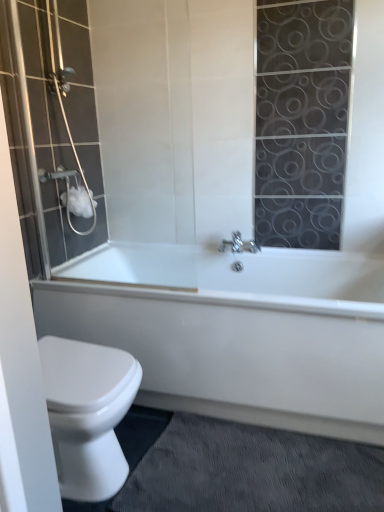
Describe the element at coordinates (79, 202) in the screenshot. The width and height of the screenshot is (384, 512). I see `white matte toilet paper at upper left` at that location.

Locate an element on the screen. This screenshot has height=512, width=384. matte glass shower door at left is located at coordinates (51, 123).

From the image's perspective, which one is positioned lower, white glossy bathtub at lower center or gray textured bath mat at lower right?

gray textured bath mat at lower right appears lower in the image.

The height and width of the screenshot is (512, 384). Identify the location of bathtub above the gray textured bath mat at lower right (from a real-world perspective). (240, 333).

From the picture: Which point is more distant from viewer, [143,383] or [153,477]?

The point [143,383] is more distant.

Is white glossy bathtub at lower center shorter than gray textured bath mat at lower right?

In fact, white glossy bathtub at lower center may be taller than gray textured bath mat at lower right.

Based on the photo, choose the correct answer: Is white matte toilet paper at upper left inside matte glass shower door at left or outside it?

white matte toilet paper at upper left is located inside matte glass shower door at left.

This screenshot has width=384, height=512. What are the coordinates of `toilet paper on the left of matte glass shower door at left` in the screenshot? It's located at (79, 202).

From a real-world perspective, which object stands above the other?

From a 3D spatial view, matte glass shower door at left is above.

Is white matte toilet paper at upper left bigger than matte glass shower door at left?

No, white matte toilet paper at upper left is not bigger than matte glass shower door at left.

I want to click on shower door lying on the left of gray textured bath mat at lower right, so click(x=51, y=123).

What's the angular difference between gray textured bath mat at lower right and matte glass shower door at left's facing directions?

The angular difference between gray textured bath mat at lower right and matte glass shower door at left is 94.9 degrees.

Is gray textured bath mat at lower right in contact with matte glass shower door at left?

No, gray textured bath mat at lower right is not in contact with matte glass shower door at left.

From a real-world perspective, is gray textured bath mat at lower right positioned under matte glass shower door at left based on gravity?

Yes.

Who is taller, white glossy bathtub at lower center or white matte toilet paper at upper left?

Standing taller between the two is white glossy bathtub at lower center.

From a real-world perspective, does white glossy bathtub at lower center stand above white matte toilet paper at upper left?

Incorrect, from a real-world perspective, white glossy bathtub at lower center is lower than white matte toilet paper at upper left.

Which object is wider, white glossy bathtub at lower center or white matte toilet paper at upper left?

white glossy bathtub at lower center.

Are white glossy bathtub at lower center and white matte toilet paper at upper left beside each other?

white glossy bathtub at lower center is not next to white matte toilet paper at upper left, and they're not touching.

From the picture: Does matte glass shower door at left touch white matte toilet paper at upper left?

matte glass shower door at left and white matte toilet paper at upper left are not in contact.

In the scene shown: Does matte glass shower door at left have a greater height compared to white matte toilet paper at upper left?

Correct, matte glass shower door at left is much taller as white matte toilet paper at upper left.

How many degrees apart are the facing directions of matte glass shower door at left and white matte toilet paper at upper left?

The angular difference between matte glass shower door at left and white matte toilet paper at upper left is 3.28 degrees.

Which object is more forward, matte glass shower door at left or gray textured bath mat at lower right?

gray textured bath mat at lower right is closer to the camera.

At what (x,y) coordinates should I click in order to perform the action: click on bath mat on the right of matte glass shower door at left. Please return your answer as a coordinate pair (x, y). Looking at the image, I should click on (251, 471).

Does matte glass shower door at left have a smaller size compared to gray textured bath mat at lower right?

No, matte glass shower door at left is not smaller than gray textured bath mat at lower right.

Could you tell me if matte glass shower door at left is facing gray textured bath mat at lower right?

No, matte glass shower door at left is not facing towards gray textured bath mat at lower right.

Does gray textured bath mat at lower right lie behind white matte toilet paper at upper left?

No, gray textured bath mat at lower right is in front of white matte toilet paper at upper left.

Is gray textured bath mat at lower right not near white matte toilet paper at upper left?

Indeed, gray textured bath mat at lower right is not near white matte toilet paper at upper left.

Can you confirm if gray textured bath mat at lower right is wider than white matte toilet paper at upper left?

Yes, gray textured bath mat at lower right is wider than white matte toilet paper at upper left.

Consider the image. How different are the orientations of gray textured bath mat at lower right and white matte toilet paper at upper left in degrees?

The facing directions of gray textured bath mat at lower right and white matte toilet paper at upper left are 91.6 degrees apart.

This screenshot has height=512, width=384. In the image, there is a white glossy bathtub at lower center. What are the coordinates of `bath mat below it (from a real-world perspective)` in the screenshot? It's located at (x=251, y=471).

I want to click on shower door above the white matte toilet paper at upper left (from the image's perspective), so click(x=51, y=123).

Based on their spatial positions, is gray textured bath mat at lower right or matte glass shower door at left further from white glossy bathtub at lower center?

matte glass shower door at left.

Based on their spatial positions, is matte glass shower door at left or gray textured bath mat at lower right closer to white glossy bathtub at lower center?

gray textured bath mat at lower right is positioned closer to the anchor white glossy bathtub at lower center.

Based on the photo, considering their positions, is matte glass shower door at left positioned further to gray textured bath mat at lower right than white matte toilet paper at upper left?

The object further to gray textured bath mat at lower right is white matte toilet paper at upper left.

From the image, which object appears to be nearer to gray textured bath mat at lower right, white glossy bathtub at lower center or matte glass shower door at left?

Based on the image, white glossy bathtub at lower center appears to be nearer to gray textured bath mat at lower right.

Considering their positions, is white matte toilet paper at upper left positioned closer to white glossy bathtub at lower center than matte glass shower door at left?

Based on the image, matte glass shower door at left appears to be nearer to white glossy bathtub at lower center.

In the scene shown: Looking at the image, which one is located closer to white matte toilet paper at upper left, white glossy bathtub at lower center or gray textured bath mat at lower right?

The object closer to white matte toilet paper at upper left is white glossy bathtub at lower center.

Considering their positions, is matte glass shower door at left positioned closer to white matte toilet paper at upper left than white glossy bathtub at lower center?

Among the two, matte glass shower door at left is located nearer to white matte toilet paper at upper left.

Which object lies nearer to the anchor point gray textured bath mat at lower right, white glossy bathtub at lower center or white matte toilet paper at upper left?

Among the two, white glossy bathtub at lower center is located nearer to gray textured bath mat at lower right.

Where is `bathtub that lies between white matte toilet paper at upper left and gray textured bath mat at lower right from top to bottom`? The image size is (384, 512). bathtub that lies between white matte toilet paper at upper left and gray textured bath mat at lower right from top to bottom is located at coordinates (240, 333).

At what (x,y) coordinates should I click in order to perform the action: click on toilet paper that lies between matte glass shower door at left and gray textured bath mat at lower right from top to bottom. Please return your answer as a coordinate pair (x, y). Looking at the image, I should click on (79, 202).

This screenshot has width=384, height=512. I want to click on toilet paper between matte glass shower door at left and white glossy bathtub at lower center in the up-down direction, so click(x=79, y=202).

Locate an element on the screen. The width and height of the screenshot is (384, 512). bathtub between matte glass shower door at left and gray textured bath mat at lower right in the up-down direction is located at coordinates (240, 333).